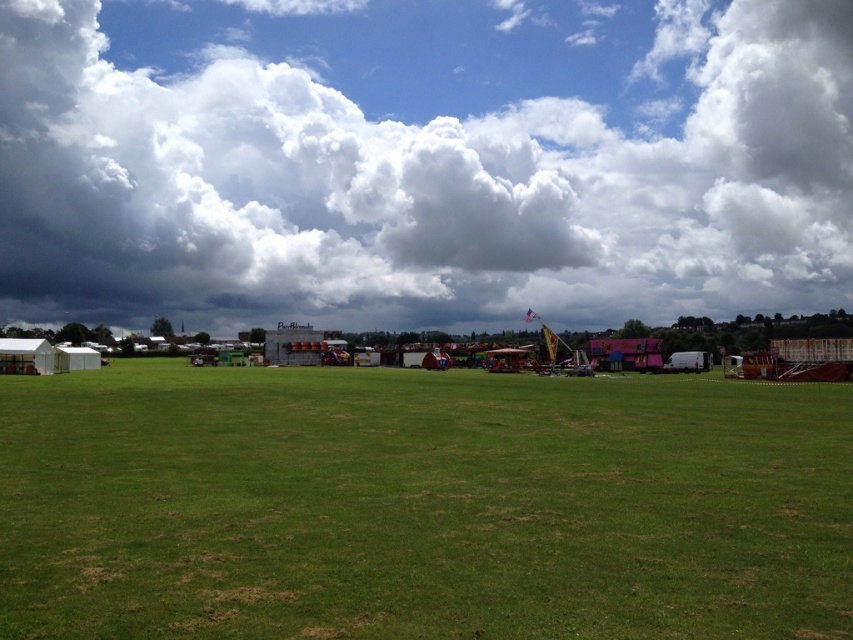
Question: Is cloudy sky at upper center above green grassy field at center?

Choices:
 (A) yes
 (B) no

Answer: (A)

Question: Among these points, which one is farthest from the camera?

Choices:
 (A) (758, 492)
 (B) (635, 76)

Answer: (B)

Question: Does cloudy sky at upper center have a greater width compared to green grassy field at center?

Choices:
 (A) yes
 (B) no

Answer: (A)

Question: Does cloudy sky at upper center have a lesser width compared to green grassy field at center?

Choices:
 (A) no
 (B) yes

Answer: (A)